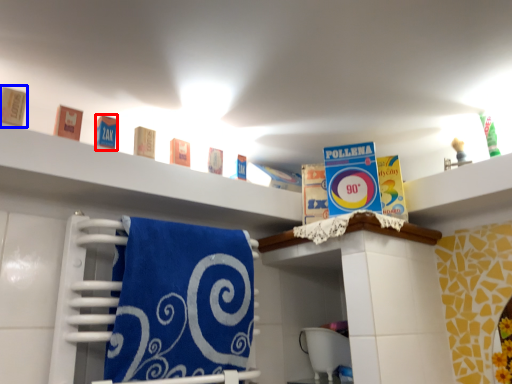
Question: Which object is further to the camera taking this photo, product (highlighted by a red box) or product (highlighted by a blue box)?

Choices:
 (A) product
 (B) product

Answer: (A)